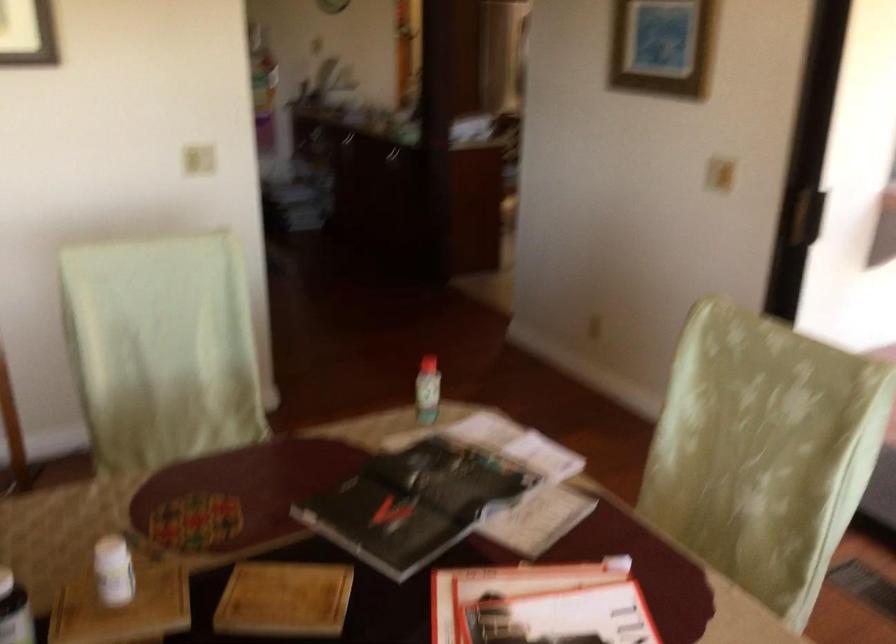
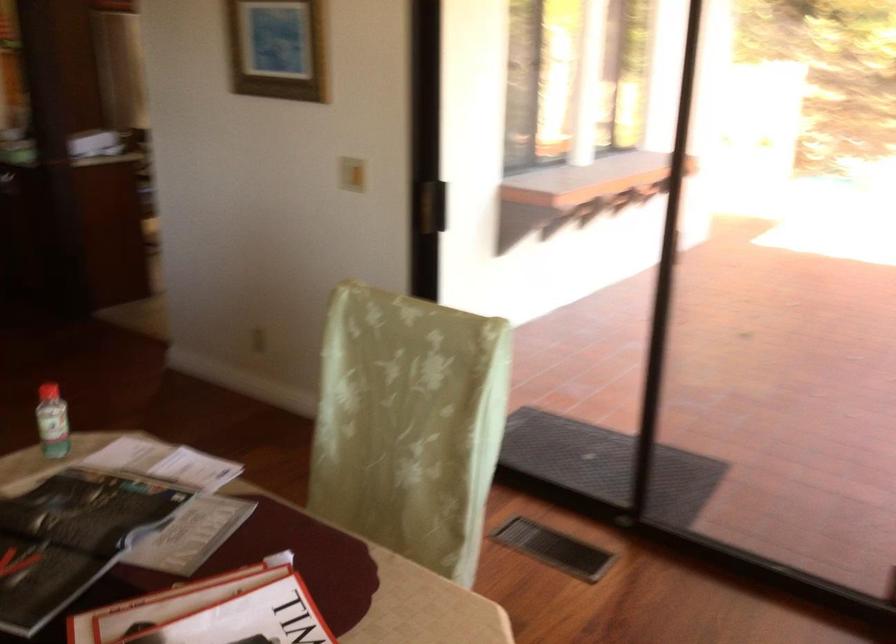
The images are taken continuously from a first-person perspective. In which direction are you moving?

The movement direction of the cameraman is right, forward.